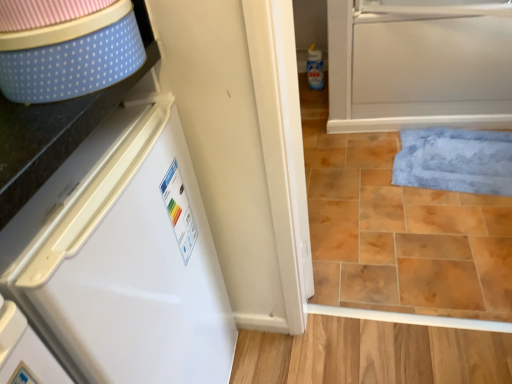
This screenshot has height=384, width=512. What do you see at coordinates (123, 258) in the screenshot? I see `white glossy refrigerator at left` at bounding box center [123, 258].

You are a GUI agent. You are given a task and a screenshot of the screen. Output one action in this format:
    pyautogui.click(x=<x>, y=<y>)
    Task: Click on the white glossy refrigerator at left
    The image size is (512, 384).
    Given the screenshot: What is the action you would take?
    pyautogui.click(x=123, y=258)

What do you see at coordinates (455, 160) in the screenshot? Image resolution: width=512 pixels, height=384 pixels. I see `blue plush bath mat at lower right` at bounding box center [455, 160].

Find the location of a particular element. The image size is (512, 384). blue plush bath mat at lower right is located at coordinates (455, 160).

Locate an element on the screen. This screenshot has width=512, height=384. white glossy refrigerator at left is located at coordinates (123, 258).

In the scene shown: Which is more to the right, blue plush bath mat at lower right or white glossy refrigerator at left?

From the viewer's perspective, blue plush bath mat at lower right appears more on the right side.

Considering the positions of objects blue plush bath mat at lower right and white glossy refrigerator at left in the image provided, who is behind, blue plush bath mat at lower right or white glossy refrigerator at left?

blue plush bath mat at lower right.

Considering the points (505, 143) and (149, 150), which point is in front, point (505, 143) or point (149, 150)?

The point (149, 150) is more forward.

From the image's perspective, which object appears higher, blue plush bath mat at lower right or white glossy refrigerator at left?

blue plush bath mat at lower right.

From a real-world perspective, is blue plush bath mat at lower right physically below white glossy refrigerator at left?

Indeed, from a real-world perspective, blue plush bath mat at lower right is positioned beneath white glossy refrigerator at left.

Does blue plush bath mat at lower right have a lesser width compared to white glossy refrigerator at left?

Correct, the width of blue plush bath mat at lower right is less than that of white glossy refrigerator at left.

Based on the photo, considering the sizes of blue plush bath mat at lower right and white glossy refrigerator at left in the image, is blue plush bath mat at lower right taller or shorter than white glossy refrigerator at left?

Considering their sizes, blue plush bath mat at lower right has less height than white glossy refrigerator at left.

Between blue plush bath mat at lower right and white glossy refrigerator at left, which one has larger size?

With larger size is white glossy refrigerator at left.

Do you think blue plush bath mat at lower right is within white glossy refrigerator at left, or outside of it?

blue plush bath mat at lower right is not enclosed by white glossy refrigerator at left.

Does blue plush bath mat at lower right touch white glossy refrigerator at left?

No, blue plush bath mat at lower right is not making contact with white glossy refrigerator at left.

Could you tell me if blue plush bath mat at lower right is facing white glossy refrigerator at left?

No, blue plush bath mat at lower right does not turn towards white glossy refrigerator at left.

What's the angular difference between blue plush bath mat at lower right and white glossy refrigerator at left's facing directions?

94.5 degrees separate the facing orientations of blue plush bath mat at lower right and white glossy refrigerator at left.

This screenshot has width=512, height=384. In the image, there is a white glossy refrigerator at left. In order to click on bath mat above it (from the image's perspective) in this screenshot , I will do `click(455, 160)`.

Between white glossy refrigerator at left and blue plush bath mat at lower right, which one appears on the left side from the viewer's perspective?

From the viewer's perspective, white glossy refrigerator at left appears more on the left side.

Looking at this image, is the position of white glossy refrigerator at left less distant than that of blue plush bath mat at lower right?

That is True.

Is point (153, 195) in front of point (424, 154)?

Yes, it is in front of point (424, 154).

From the image's perspective, which is above, white glossy refrigerator at left or blue plush bath mat at lower right?

blue plush bath mat at lower right.

From a real-world perspective, which object rests below the other?

In real-world perspective, blue plush bath mat at lower right is lower.

Does white glossy refrigerator at left have a lesser width compared to blue plush bath mat at lower right?

Incorrect, the width of white glossy refrigerator at left is not less than that of blue plush bath mat at lower right.

In terms of height, does white glossy refrigerator at left look taller or shorter compared to blue plush bath mat at lower right?

white glossy refrigerator at left is taller than blue plush bath mat at lower right.

From the picture: Does white glossy refrigerator at left have a larger size compared to blue plush bath mat at lower right?

Correct, white glossy refrigerator at left is larger in size than blue plush bath mat at lower right.

Is white glossy refrigerator at left inside the boundaries of blue plush bath mat at lower right, or outside?

white glossy refrigerator at left lies outside blue plush bath mat at lower right.

Are white glossy refrigerator at left and blue plush bath mat at lower right making contact?

No, white glossy refrigerator at left is not beside blue plush bath mat at lower right.

Is white glossy refrigerator at left positioned with its back to blue plush bath mat at lower right?

No, white glossy refrigerator at left is not facing the opposite direction of blue plush bath mat at lower right.

This screenshot has width=512, height=384. I want to click on bath mat lying behind the white glossy refrigerator at left, so click(x=455, y=160).

Locate an element on the screen. The height and width of the screenshot is (384, 512). refrigerator below the blue plush bath mat at lower right (from the image's perspective) is located at coordinates (123, 258).

Locate an element on the screen. The width and height of the screenshot is (512, 384). refrigerator above the blue plush bath mat at lower right (from a real-world perspective) is located at coordinates (123, 258).